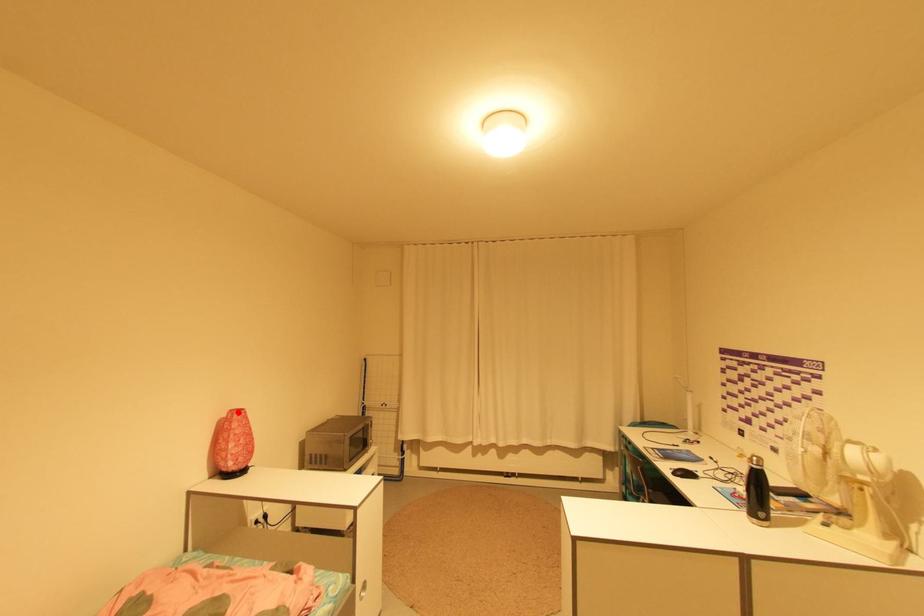
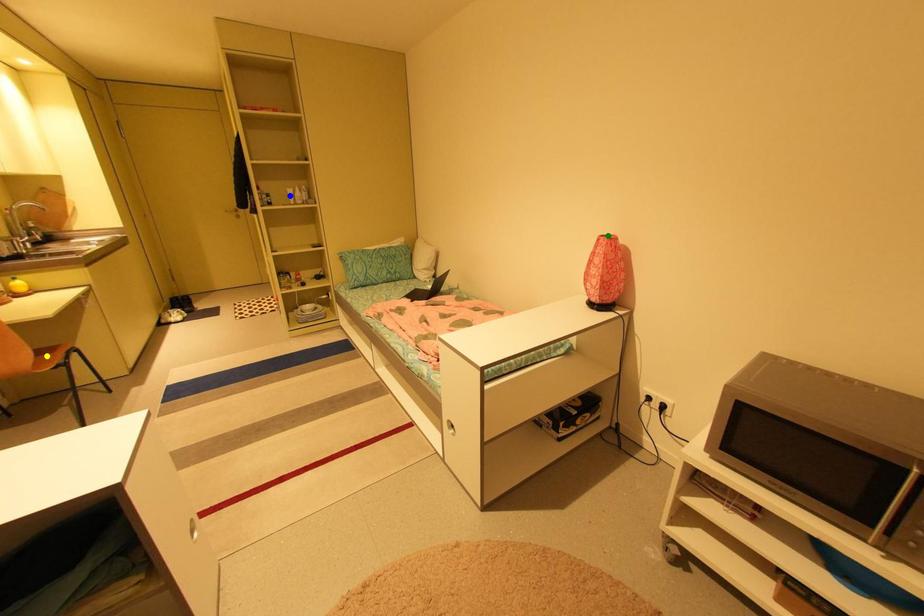
Question: I am providing you with two images of the same scene from different viewpoints. A red point is marked on the first image. You are given multiple points on the second image. Can you choose the point in image 2 that corresponds to the point in image 1?

Choices:
 (A) green point
 (B) yellow point
 (C) blue point

Answer: (A)